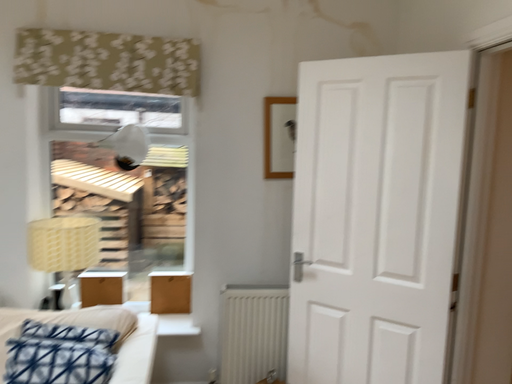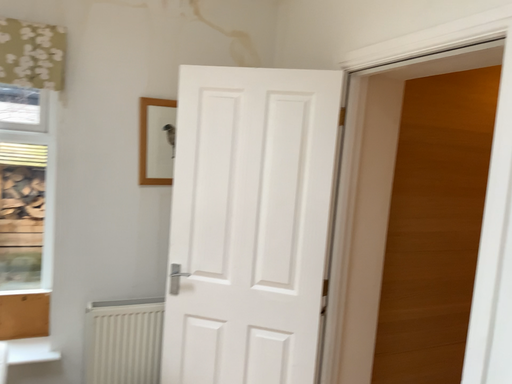
Question: Which way did the camera rotate in the video?

Choices:
 (A) rotated right
 (B) rotated left

Answer: (A)